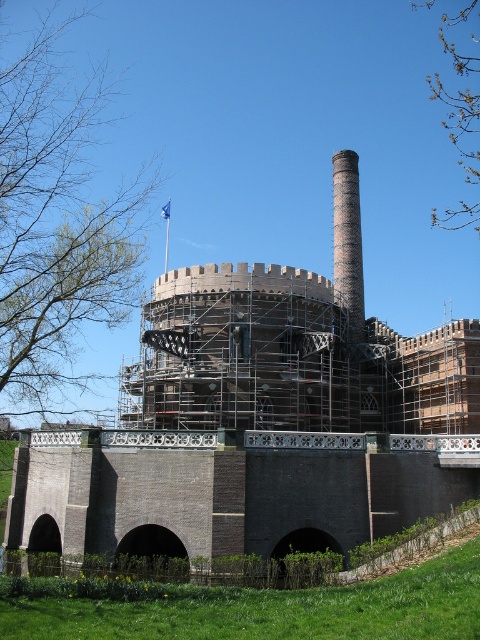
Which is above, brick scaffolding at center or brick chimney at center?

brick chimney at center is above.

Between point (101, 522) and point (334, 195), which one is positioned in front?

Point (101, 522) is more forward.

Between point (197, 324) and point (354, 266), which one is positioned behind?

The point (354, 266) is behind.

The height and width of the screenshot is (640, 480). In order to click on brick scaffolding at center in this screenshot , I will do `click(250, 432)`.